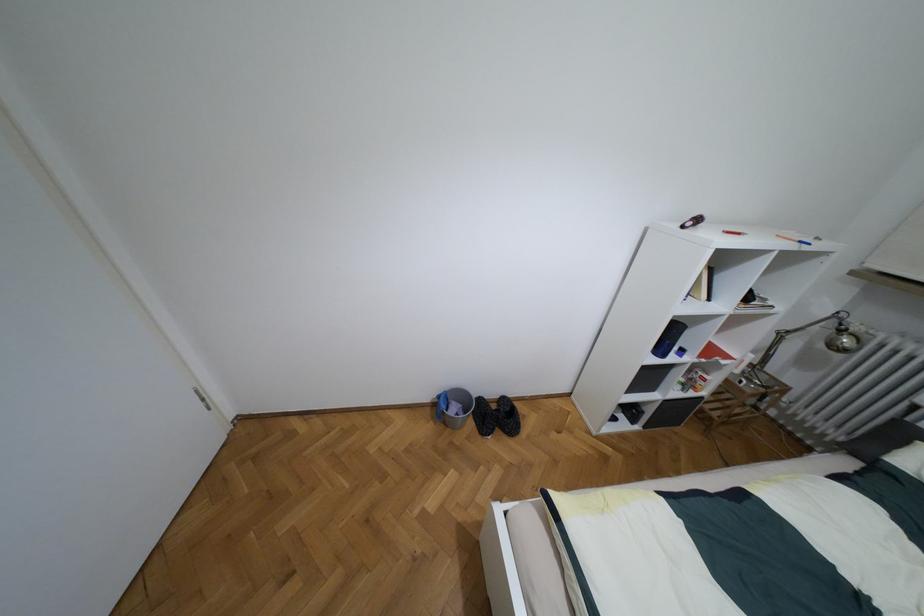
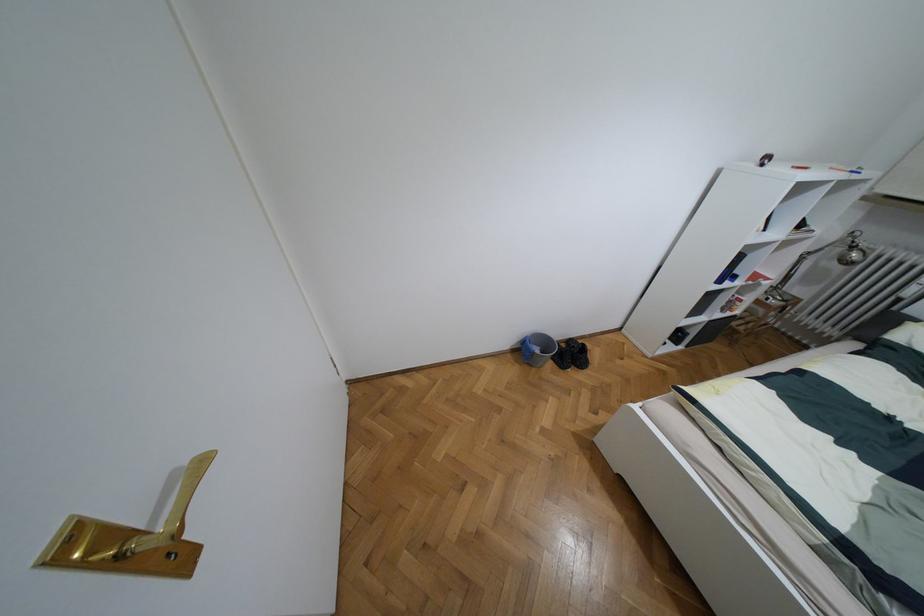
In the second image, find the point that corresponds to (840,330) in the first image.

(852, 246)